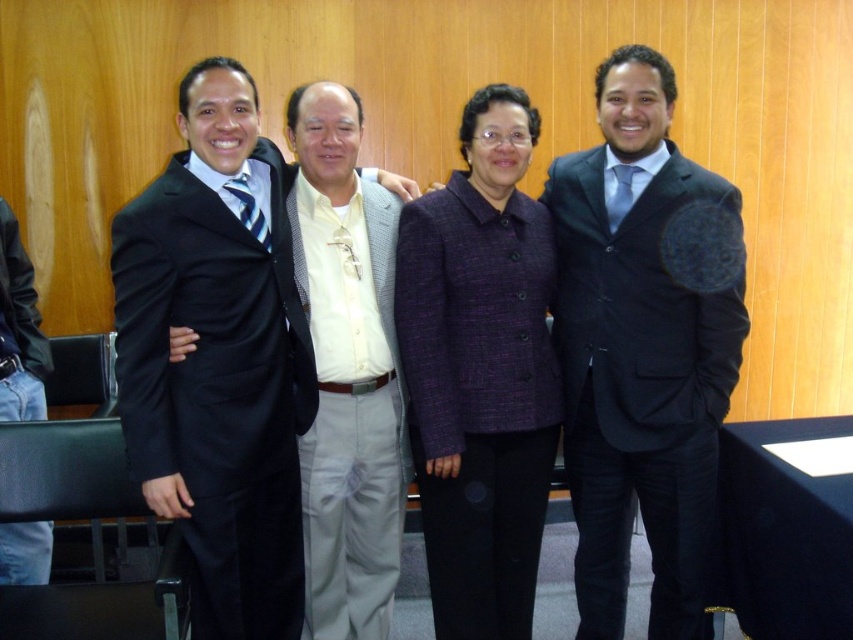
Where is the matte black suit at left located in the image?

The matte black suit at left is located at point 0.561 on the x axis and 0.257 on the y axis.

You are a photographer adjusting the lighting for a group photo. You need to ensure that the matte black suit at right and the purple textured blazer at center are both well lit. Which one might require more direct lighting to avoid appearing too dark?

The matte black suit at right might require more direct lighting because matte black surfaces generally absorb more light and can appear darker in photos compared to the purple textured blazer at center, which may reflect light better due to its texture and color.

You are a photographer setting up for a group photo. You need to adjust the camera focus so that both the matte black suit at left and the white textured shirt at center are in focus. Based on their positions, which one should you focus on first to ensure both are sharp?

You should focus on the matte black suit at left first because it is above the white textured shirt at center, so focusing on the closer object ensures both are in focus.